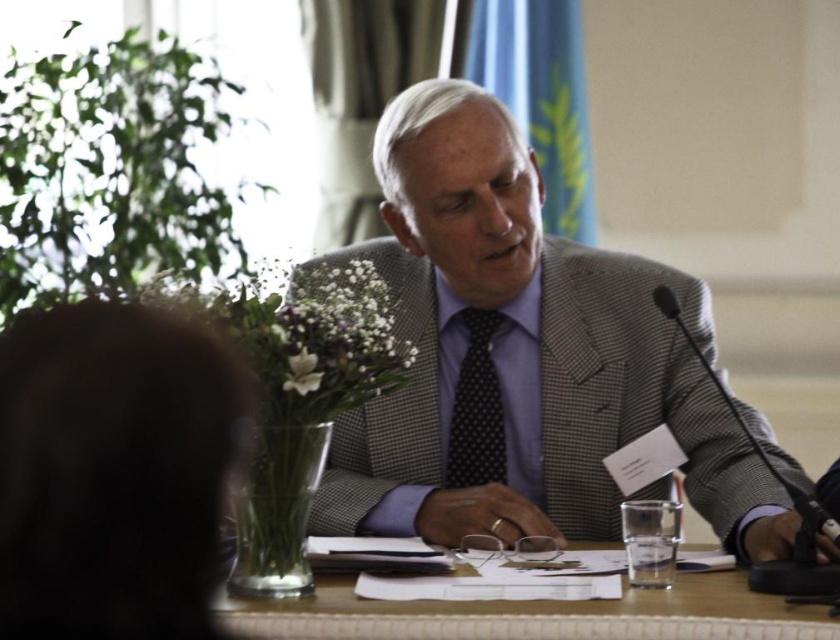
You are standing in the conference room and want to place a name tag on the table. The name tag is exactly at point (525,355). What object is located at that point?

The gray textured suit at center is located at point (525,355).

You are an event organizer arranging seating for a panel discussion. You need to ensure that the gray textured suit at center and the wooden table at center fit within a 1.5 meter wide stage. Given their widths, can both items be placed side by side on the stage without exceeding the width limit?

The gray textured suit at center is wider than the wooden table at center. However, since the exact widths are not provided, it is impossible to determine if both can fit within the 1.5 meter stage width. More information about their specific dimensions is needed to make an accurate assessment.

From the picture: You are organizing a meeting and need to place a 15 cm tall decorative vase on the wooden table at center. According to the scene, will the vase fit vertically on the table without touching the polka dot silk tie at center?

The wooden table at center is not as tall as polka dot silk tie at center, meaning the table is shorter than the tie. Since the vase is 15 cm tall, if the table height allows, it can be placed without touching the tie as long as there is enough space between them. However, the exact placement depends on their positions not described here.